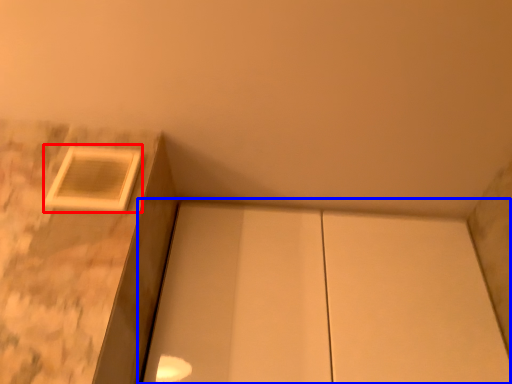
Question: Among these objects, which one is nearest to the camera, window (highlighted by a red box) or cabinetry (highlighted by a blue box)?

Choices:
 (A) window
 (B) cabinetry

Answer: (A)